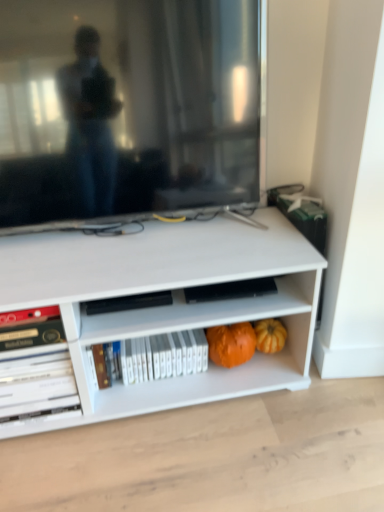
This screenshot has width=384, height=512. I want to click on vacant region in front of white glossy bookshelf at center, which is counted as the second book, starting from the left, so click(155, 415).